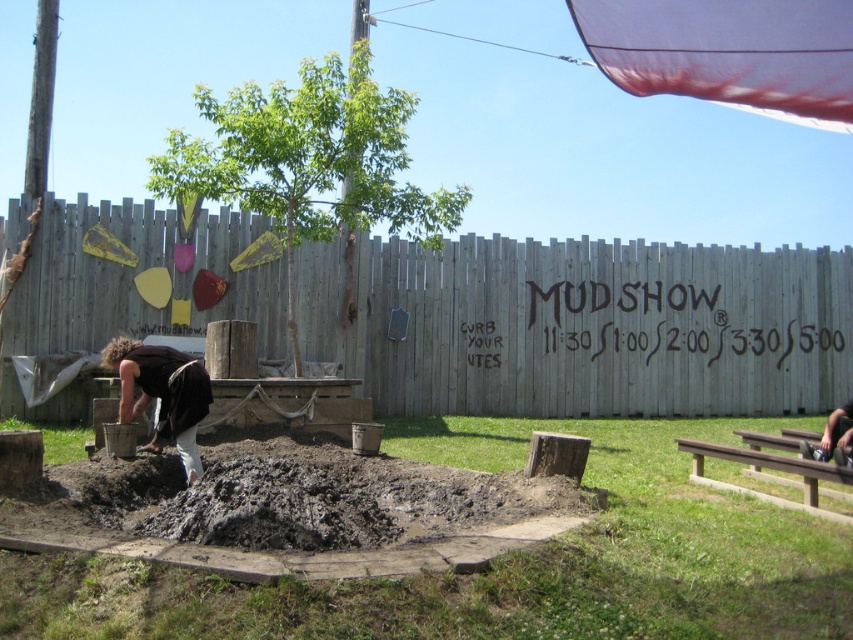
From the picture: Is brown mud pit at lower center to the left of metallic silver squat at lower right from the viewer's perspective?

Indeed, brown mud pit at lower center is positioned on the left side of metallic silver squat at lower right.

Find the location of a particular element. This screenshot has width=853, height=640. brown mud pit at lower center is located at coordinates (503, 563).

Is point (601, 468) farther from camera compared to point (844, 449)?

That is True.

I want to click on brown mud pit at lower center, so click(503, 563).

What do you see at coordinates (503, 563) in the screenshot? Image resolution: width=853 pixels, height=640 pixels. I see `brown mud pit at lower center` at bounding box center [503, 563].

Which is more to the right, brown mud pit at lower center or dark brown wood at lower left?

Positioned to the right is brown mud pit at lower center.

Does point (752, 420) come in front of point (160, 428)?

No, (752, 420) is further to viewer.

You are a GUI agent. You are given a task and a screenshot of the screen. Output one action in this format:
    pyautogui.click(x=<x>, y=<y>)
    Task: Click on the brown mud pit at lower center
    Image resolution: width=853 pixels, height=640 pixels.
    Given the screenshot: What is the action you would take?
    pyautogui.click(x=503, y=563)

Based on the photo, does green leafy tree at center lie in front of metallic silver squat at lower right?

No, green leafy tree at center is further to the viewer.

Is green leafy tree at center further to the viewer compared to metallic silver squat at lower right?

Yes, it is behind metallic silver squat at lower right.

Is point (340, 225) less distant than point (848, 451)?

No, it is behind (848, 451).

Identify the location of green leafy tree at center. (310, 164).